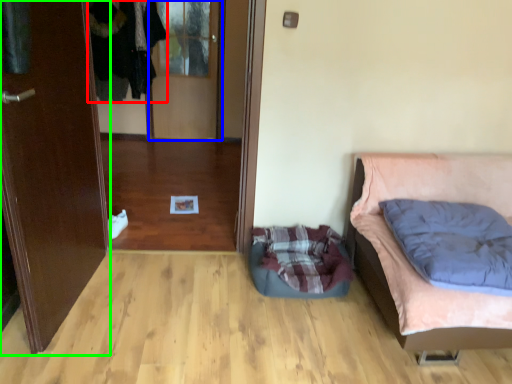
Question: Estimate the real-world distances between objects in this image. Which object is farther from clothing (highlighted by a red box), glass door (highlighted by a blue box) or door (highlighted by a green box)?

Choices:
 (A) glass door
 (B) door

Answer: (B)